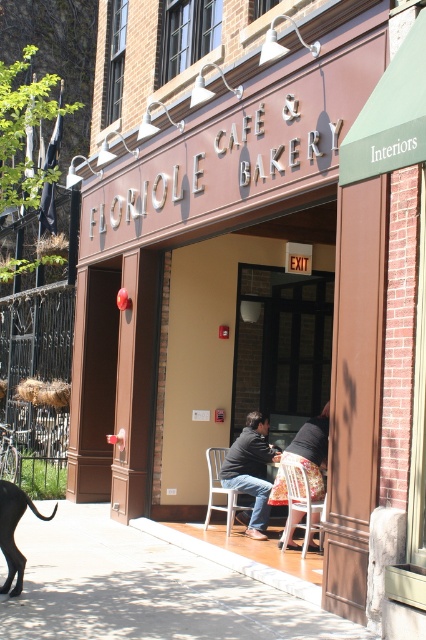
You are a delivery person with a large box that is 1 meter wide. You need to place it on either the smooth concrete pavement at center or the metallic silver chair at lower center. Based on their widths, which surface can safely accommodate the box without overhanging?

The smooth concrete pavement at center might be wider than metallic silver chair at lower center, so it is more likely to safely accommodate the box without overhanging.

You are standing outside the entrance of the cafe and want to sit down. Which object should you choose between the smooth concrete pavement at center and the metallic silver chair at lower center?

You should choose the metallic silver chair at lower center because the smooth concrete pavement at center is positioned under it, meaning the chair is above the pavement and accessible for sitting.

You are standing at the entrance of Floriole Cafe and Bakery. You see a wooden at center and a metallic silver chair at lower center. Which object is positioned to the right from your perspective?

The wooden at center is positioned to the right of the metallic silver chair at lower center.